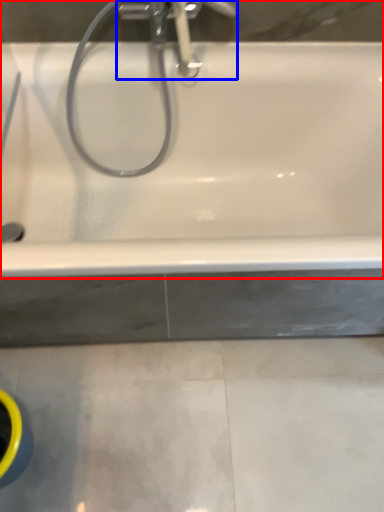
Question: Which object appears farthest to the camera in this image, bathtub (highlighted by a red box) or tap (highlighted by a blue box)?

Choices:
 (A) bathtub
 (B) tap

Answer: (B)